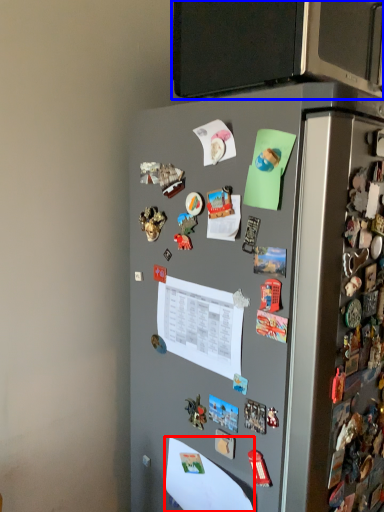
Question: Among these objects, which one is nearest to the camera, paper (highlighted by a red box) or back (highlighted by a blue box)?

Choices:
 (A) paper
 (B) back

Answer: (B)